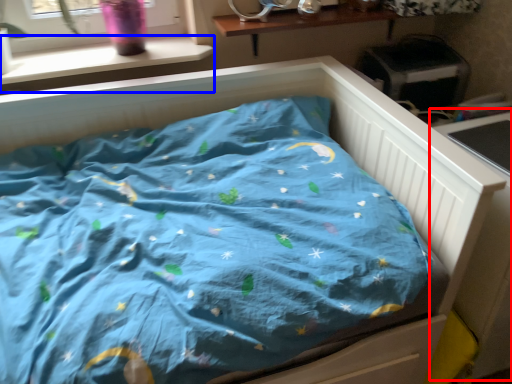
Question: Which of the following is the closest to the observer, table (highlighted by a red box) or window sill (highlighted by a blue box)?

Choices:
 (A) table
 (B) window sill

Answer: (A)